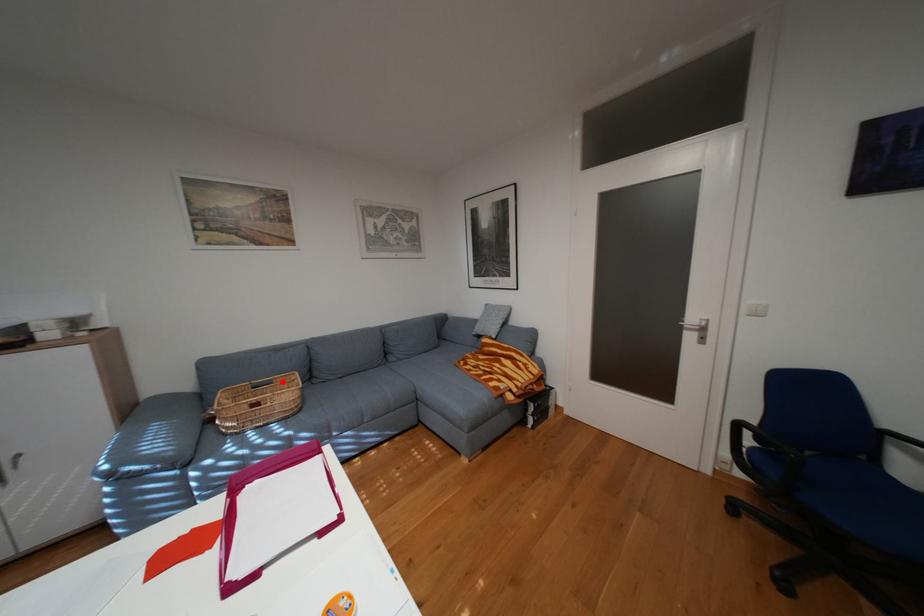
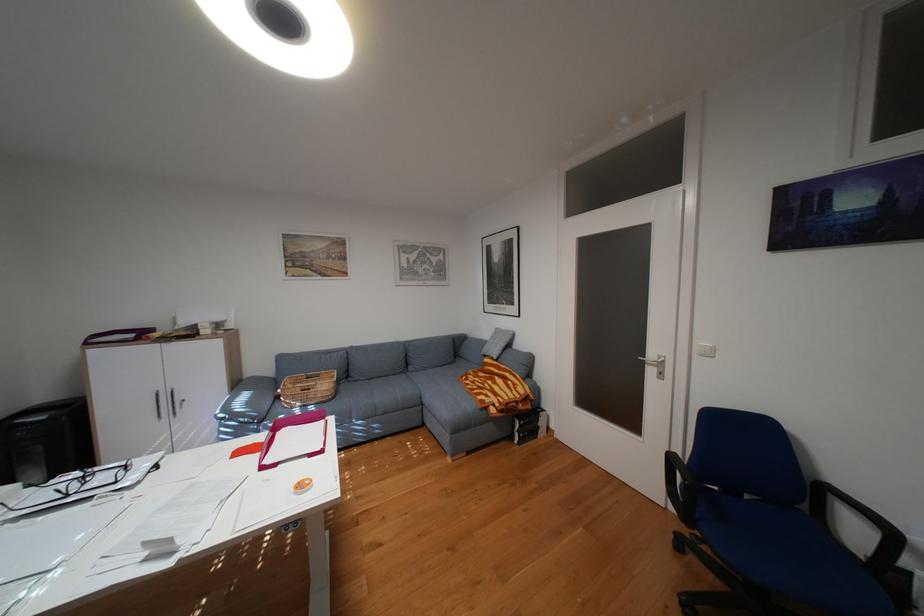
Where in the second image is the point corresponding to the highlighted location from the first image?

(331, 375)